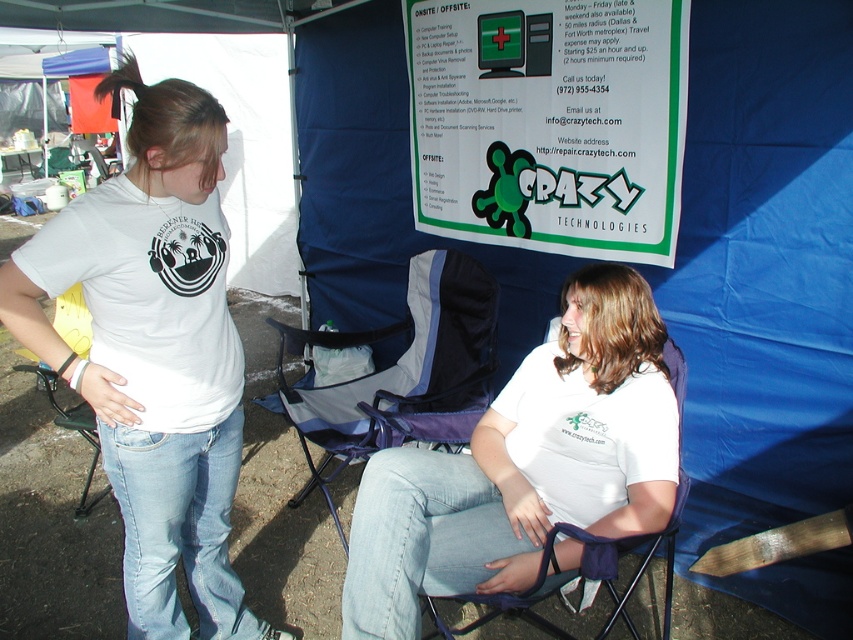
Based on the scene description, which object is positioned higher up in the image between the white cotton shirt at center and the light blue denim jeans at lower left?

The white cotton shirt at center is positioned higher up in the image than the light blue denim jeans at lower left because it is described as much taller.

You are organizing a small outdoor event and need to ensure that all items fit within a 1.2 meter wide storage container. Given the white cotton shirt at center and the black plastic chair at left, which item will require more space when stored?

The black plastic chair at left requires more space when stored because the white cotton shirt at center occupies less space than it.